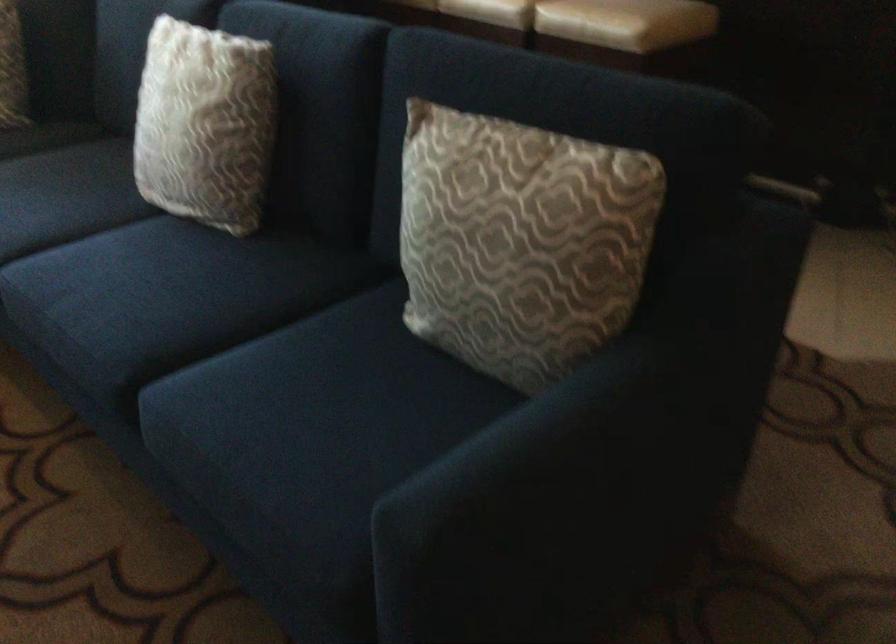
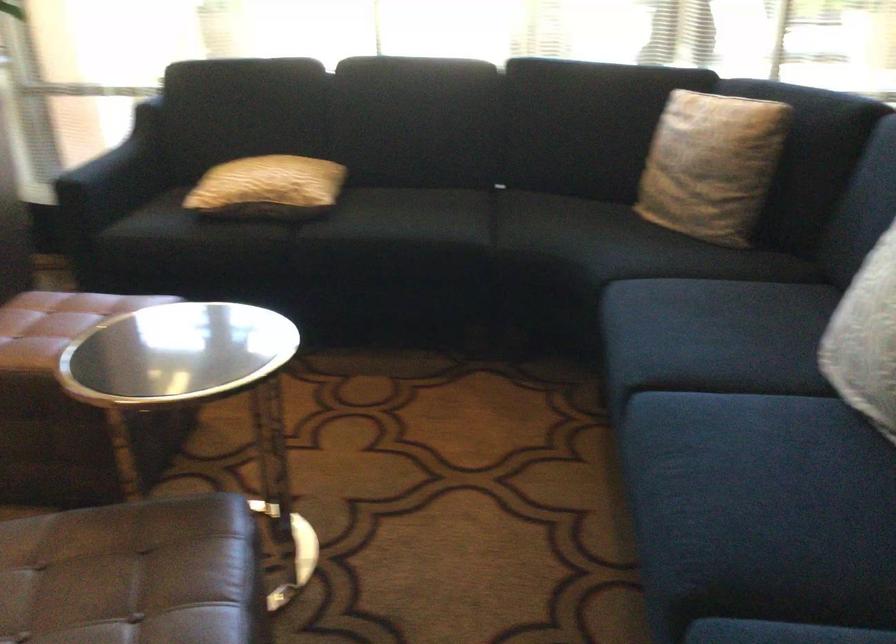
The point at (165, 162) is marked in the first image. Where is the corresponding point in the second image?

(866, 339)